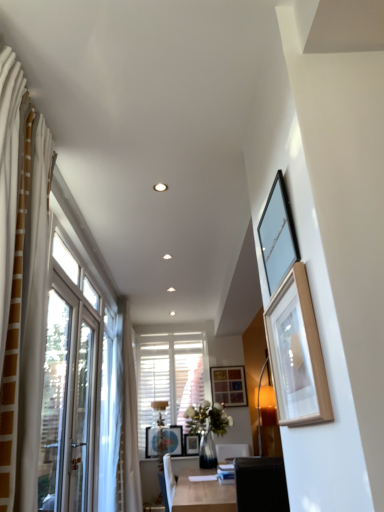
Describe the element at coordinates (164, 440) in the screenshot. The width and height of the screenshot is (384, 512). I see `wooden picture frame at center, which ranks as the fourth picture frame in top-to-bottom order` at that location.

The width and height of the screenshot is (384, 512). What are the coordinates of `wooden picture frame at upper right, the 5th picture frame from the back` in the screenshot? It's located at (296, 354).

What do you see at coordinates (191, 444) in the screenshot?
I see `wooden picture frame at center, acting as the fifth picture frame starting from the top` at bounding box center [191, 444].

This screenshot has height=512, width=384. In order to click on light wood table at center in this screenshot , I will do `click(203, 494)`.

What do you see at coordinates (277, 234) in the screenshot? The image size is (384, 512). I see `matte black picture frame at upper right, the second picture frame in the front-to-back sequence` at bounding box center [277, 234].

At what (x,y) coordinates should I click in order to perform the action: click on wooden picture frame at center, the 3th picture frame when ordered from back to front. Please return your answer as a coordinate pair (x, y). The width and height of the screenshot is (384, 512). Looking at the image, I should click on (164, 440).

From the image's perspective, between wooden picture frame at center, which appears as the 4th picture frame when viewed from the front, and matte black picture frame at upper right, the 3th picture frame in the right-to-left sequence, which one is located above?

matte black picture frame at upper right, the 3th picture frame in the right-to-left sequence, is shown above in the image.

From the picture: Is matte black picture frame at upper right, the fourth picture frame positioned from the back, surrounded by wooden picture frame at center, which appears as the 4th picture frame when viewed from the front?

No, matte black picture frame at upper right, the fourth picture frame positioned from the back, is not inside wooden picture frame at center, which appears as the 4th picture frame when viewed from the front.

Would you say wooden picture frame at center, placed as the first picture frame when sorted from bottom to top, is to the left or to the right of matte black picture frame at upper right, which appears as the 3th picture frame when viewed from the left, in the picture?

In the image, wooden picture frame at center, placed as the first picture frame when sorted from bottom to top, appears on the left side of matte black picture frame at upper right, which appears as the 3th picture frame when viewed from the left.

Between wooden picture frame at center, which is the 5th picture frame in left-to-right order, and wooden picture frame at center, the 2th picture frame viewed from the back, which one is positioned in front?

wooden picture frame at center, the 2th picture frame viewed from the back, is closer to the camera.

Which is correct: wooden picture frame at center, which is the 5th picture frame in left-to-right order, is inside wooden picture frame at center, the second picture frame viewed from the left, or outside of it?

wooden picture frame at center, which is the 5th picture frame in left-to-right order, exists outside the volume of wooden picture frame at center, the second picture frame viewed from the left.

Who is smaller, wooden picture frame at center, the first picture frame from the back, or wooden picture frame at center, acting as the fifth picture frame starting from the top?

wooden picture frame at center, acting as the fifth picture frame starting from the top.

Between wooden picture frame at center, positioned as the third picture frame in top-to-bottom order, and wooden picture frame at center, placed as the first picture frame when sorted from bottom to top, which one has larger width?

wooden picture frame at center, positioned as the third picture frame in top-to-bottom order.

From the image's perspective, is wooden picture frame at center, the 3th picture frame in the front-to-back sequence, beneath light wood table at center?

Correct, wooden picture frame at center, the 3th picture frame in the front-to-back sequence, appears lower than light wood table at center in the image.

Considering the positions of point (149, 429) and point (197, 489), is point (149, 429) closer or farther from the camera than point (197, 489)?

Point (149, 429) is positioned farther from the camera compared to point (197, 489).

Is wooden picture frame at center, the 3th picture frame when ordered from back to front, oriented away from light wood table at center?

No, light wood table at center is not at the back of wooden picture frame at center, the 3th picture frame when ordered from back to front.

Which of these two, wooden picture frame at center, the 3th picture frame when ordered from back to front, or light wood table at center, is thinner?

Thinner between the two is wooden picture frame at center, the 3th picture frame when ordered from back to front.

Is there a large distance between wooden picture frame at center, the first picture frame from the back, and wooden picture frame at center, which ranks as the 5th picture frame in right-to-left order?

No, wooden picture frame at center, the first picture frame from the back, is not far from wooden picture frame at center, which ranks as the 5th picture frame in right-to-left order.

Can you confirm if wooden picture frame at center, which is the 5th picture frame in left-to-right order, is positioned to the left of wooden picture frame at center, which ranks as the fourth picture frame in top-to-bottom order?

No, wooden picture frame at center, which is the 5th picture frame in left-to-right order, is not to the left of wooden picture frame at center, which ranks as the fourth picture frame in top-to-bottom order.

Could you tell me if wooden picture frame at center, the first picture frame from the back, is turned towards wooden picture frame at center, which ranks as the 5th picture frame in right-to-left order?

No, wooden picture frame at center, the first picture frame from the back, is not turned towards wooden picture frame at center, which ranks as the 5th picture frame in right-to-left order.

Is matte black picture frame at upper right, the second picture frame in the front-to-back sequence, turned away from wooden picture frame at center, placed as the first picture frame when sorted from bottom to top?

No, matte black picture frame at upper right, the second picture frame in the front-to-back sequence,'s orientation is not away from wooden picture frame at center, placed as the first picture frame when sorted from bottom to top.

Are matte black picture frame at upper right, the second picture frame in the front-to-back sequence, and wooden picture frame at center, which appears as the 4th picture frame when viewed from the right, beside each other?

matte black picture frame at upper right, the second picture frame in the front-to-back sequence, is not next to wooden picture frame at center, which appears as the 4th picture frame when viewed from the right, and they're not touching.

Based on the photo, considering the relative positions of matte black picture frame at upper right, the second picture frame in the front-to-back sequence, and wooden picture frame at center, the second picture frame viewed from the left, in the image provided, is matte black picture frame at upper right, the second picture frame in the front-to-back sequence, to the right of wooden picture frame at center, the second picture frame viewed from the left, from the viewer's perspective?

Indeed, matte black picture frame at upper right, the second picture frame in the front-to-back sequence, is positioned on the right side of wooden picture frame at center, the second picture frame viewed from the left.

From the image's perspective, count 4th picture frames downward from the matte black picture frame at upper right, the fourth picture frame positioned from the back, and point to it. Please provide its 2D coordinates.

[(191, 444)]

Between light wood table at center and matte black picture frame at upper right, which appears as the 3th picture frame when viewed from the left, which one has larger width?

With larger width is light wood table at center.

Are light wood table at center and matte black picture frame at upper right, the 5th picture frame ordered from the bottom, far apart?

Yes, light wood table at center is far from matte black picture frame at upper right, the 5th picture frame ordered from the bottom.

This screenshot has width=384, height=512. Identify the location of table below the matte black picture frame at upper right, which appears as the 3th picture frame when viewed from the left (from the image's perspective). (203, 494).

Can you tell me how much light wood table at center and matte black picture frame at upper right, the 3th picture frame in the right-to-left sequence, differ in facing direction?

The angle between the facing direction of light wood table at center and the facing direction of matte black picture frame at upper right, the 3th picture frame in the right-to-left sequence, is 179 degrees.

Is light wood table at center outside of wooden picture frame at upper right, marked as the second picture frame in a right-to-left arrangement?

Absolutely, light wood table at center is external to wooden picture frame at upper right, marked as the second picture frame in a right-to-left arrangement.

From a real-world perspective, is light wood table at center under wooden picture frame at upper right, acting as the fourth picture frame starting from the left?

Yes, from a real-world perspective, light wood table at center is under wooden picture frame at upper right, acting as the fourth picture frame starting from the left.

How many degrees apart are the facing directions of light wood table at center and wooden picture frame at upper right, which is the 1th picture frame from front to back?

The angle between the facing direction of light wood table at center and the facing direction of wooden picture frame at upper right, which is the 1th picture frame from front to back, is 179 degrees.

Who is shorter, light wood table at center or wooden picture frame at upper right, the 5th picture frame from the back?

wooden picture frame at upper right, the 5th picture frame from the back, is shorter.

Locate an element on the screen. the 1st picture frame counting from the right side of the wooden picture frame at center, acting as the fifth picture frame starting from the top is located at coordinates (277, 234).

Identify the location of the 1st picture frame in front of the wooden picture frame at center, marked as the first picture frame in a right-to-left arrangement, starting your count from the anchor. The width and height of the screenshot is (384, 512). (191, 444).

Considering their positions, is wooden picture frame at center, the first picture frame from the back, positioned closer to light wood table at center than wooden picture frame at center, arranged as the first picture frame when viewed from the left?

wooden picture frame at center, arranged as the first picture frame when viewed from the left, lies closer to light wood table at center than the other object.

Considering their positions, is wooden picture frame at center, the 2th picture frame positioned from the bottom, positioned further to light wood table at center than matte black picture frame at upper right, the fourth picture frame positioned from the back?

wooden picture frame at center, the 2th picture frame positioned from the bottom.

Based on their spatial positions, is wooden picture frame at center, the 3th picture frame in the front-to-back sequence, or wooden picture frame at upper right, acting as the second picture frame starting from the top, further from matte black picture frame at upper right, the second picture frame in the front-to-back sequence?

Based on the image, wooden picture frame at center, the 3th picture frame in the front-to-back sequence, appears to be further to matte black picture frame at upper right, the second picture frame in the front-to-back sequence.

Which object lies further to the anchor point wooden picture frame at center, which is the 5th picture frame in left-to-right order, wooden picture frame at center, which appears as the 4th picture frame when viewed from the front, or light wood table at center?

The object further to wooden picture frame at center, which is the 5th picture frame in left-to-right order, is light wood table at center.

From the image, which object appears to be farther from matte black picture frame at upper right, the 3th picture frame in the right-to-left sequence, wooden picture frame at upper right, which is the 1th picture frame from front to back, or wooden picture frame at center, which appears as the 4th picture frame when viewed from the right?

The object further to matte black picture frame at upper right, the 3th picture frame in the right-to-left sequence, is wooden picture frame at center, which appears as the 4th picture frame when viewed from the right.

Based on their spatial positions, is wooden picture frame at center, which ranks as the 5th picture frame in right-to-left order, or wooden picture frame at center, placed as the first picture frame when sorted from bottom to top, further from wooden picture frame at upper right, marked as the second picture frame in a right-to-left arrangement?

wooden picture frame at center, which ranks as the 5th picture frame in right-to-left order.

Considering their positions, is light wood table at center positioned further to wooden picture frame at center, acting as the fifth picture frame starting from the top, than wooden picture frame at center, the 2th picture frame positioned from the bottom?

light wood table at center is further to wooden picture frame at center, acting as the fifth picture frame starting from the top.

When comparing their distances from light wood table at center, does wooden picture frame at upper right, which is the 1th picture frame from front to back, or wooden picture frame at center, which appears as the 4th picture frame when viewed from the front, seem closer?

wooden picture frame at center, which appears as the 4th picture frame when viewed from the front, lies closer to light wood table at center than the other object.

Find the location of a particular element. Image resolution: width=384 pixels, height=512 pixels. picture frame between matte black picture frame at upper right, the fourth picture frame positioned from the back, and wooden picture frame at center, which appears as the 4th picture frame when viewed from the right, from front to back is located at coordinates (164, 440).

Image resolution: width=384 pixels, height=512 pixels. I want to click on table located between matte black picture frame at upper right, the fourth picture frame positioned from the back, and wooden picture frame at center, which appears as the 4th picture frame when viewed from the front, in the depth direction, so click(x=203, y=494).

Identify the location of picture frame between light wood table at center and wooden picture frame at center, placed as the first picture frame when sorted from bottom to top, in the front-back direction. (164, 440).

Locate an element on the screen. This screenshot has width=384, height=512. picture frame between wooden picture frame at upper right, which is the 1th picture frame from front to back, and wooden picture frame at center, the 2th picture frame positioned from the bottom, from front to back is located at coordinates (277, 234).